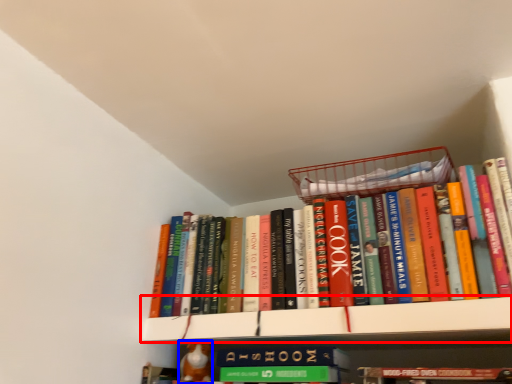
Question: Which object is closer to the camera taking this photo, shelf (highlighted by a red box) or toy (highlighted by a blue box)?

Choices:
 (A) shelf
 (B) toy

Answer: (A)